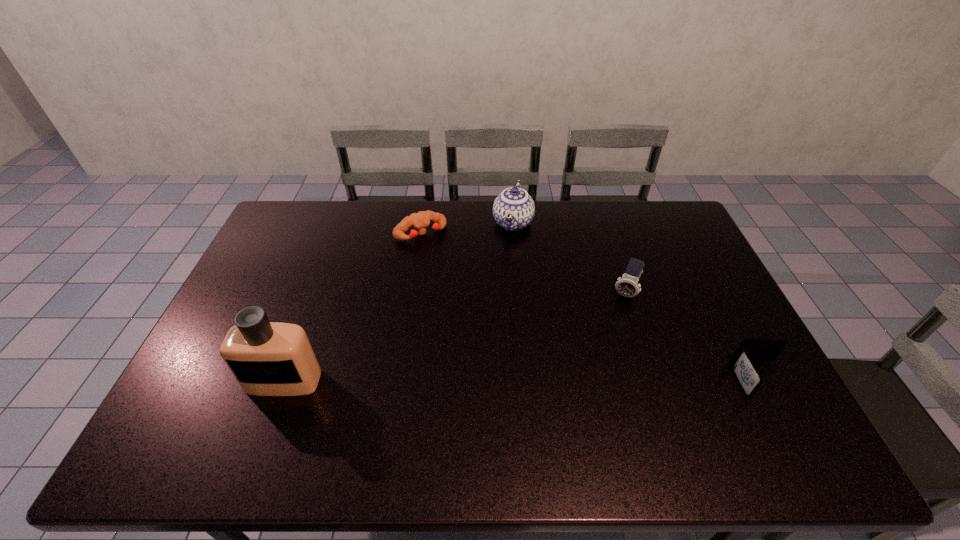
At what (x,y) coordinates should I click in order to perform the action: click on object that can be found as the third closest to the third farthest object. Please return your answer as a coordinate pair (x, y). This screenshot has height=540, width=960. Looking at the image, I should click on (419, 221).

The width and height of the screenshot is (960, 540). I want to click on vacant space that satisfies the following two spatial constraints: 1. on the front side of the third shortest object; 2. on the right side of the fourth shortest object, so click(x=519, y=293).

This screenshot has height=540, width=960. What are the coordinates of `vacant region that satisfies the following two spatial constraints: 1. on the back side of the second object from left to right; 2. on the left side of the second tallest object` in the screenshot? It's located at (x=422, y=222).